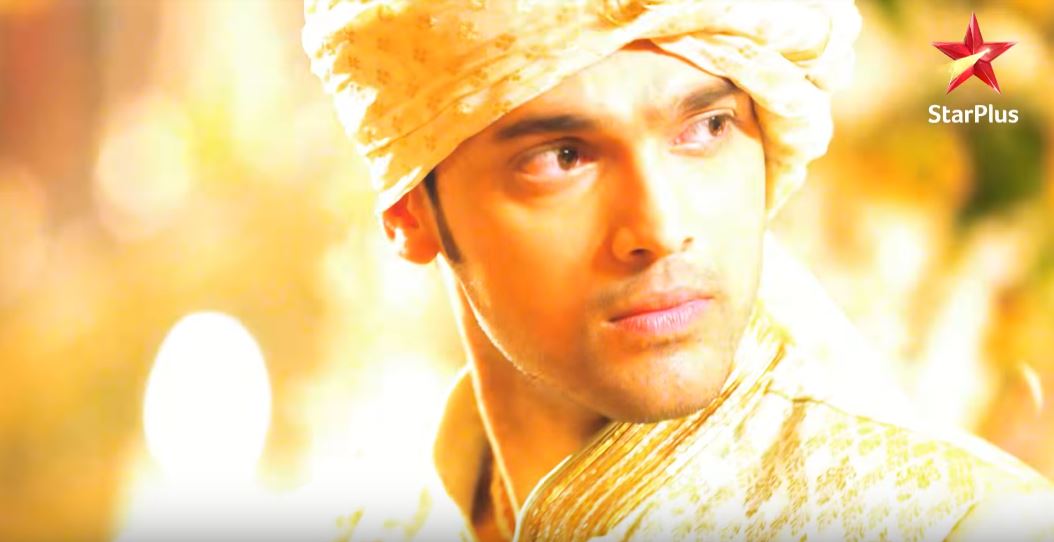
The height and width of the screenshot is (542, 1054). I want to click on cover, so click(x=492, y=34).